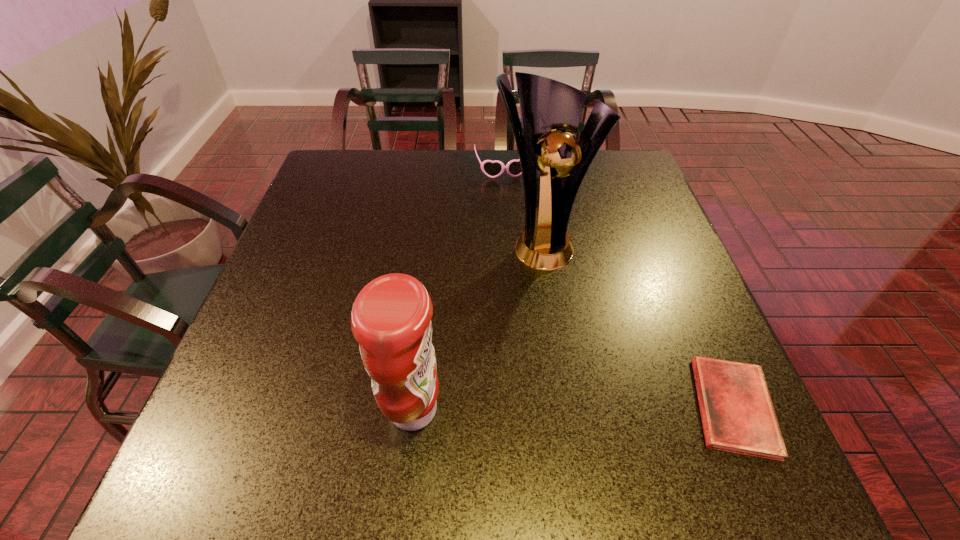
In order to click on object that is at the near right corner in this screenshot , I will do `click(737, 413)`.

In the image, there is a desktop. Where is `vacant space at the far edge`? The height and width of the screenshot is (540, 960). vacant space at the far edge is located at coordinates (x=397, y=173).

I want to click on free spot at the near edge of the desktop, so click(558, 422).

In the image, there is a desktop. What are the coordinates of `vacant space at the left edge` in the screenshot? It's located at (300, 274).

This screenshot has width=960, height=540. I want to click on free space at the right edge of the desktop, so click(x=699, y=323).

The image size is (960, 540). Identify the location of vacant space at the far left corner of the desktop. (370, 177).

Where is `vacant space at the near left corner of the desktop`? The height and width of the screenshot is (540, 960). vacant space at the near left corner of the desktop is located at coordinates coord(287,427).

Find the location of a particular element. This screenshot has height=540, width=960. vacant space at the far right corner is located at coordinates (604, 151).

Locate an element on the screen. vacant space that is in between the rightmost object and the farthest object is located at coordinates (617, 288).

Where is `blank region between the shortest object and the award`? The image size is (960, 540). blank region between the shortest object and the award is located at coordinates (637, 325).